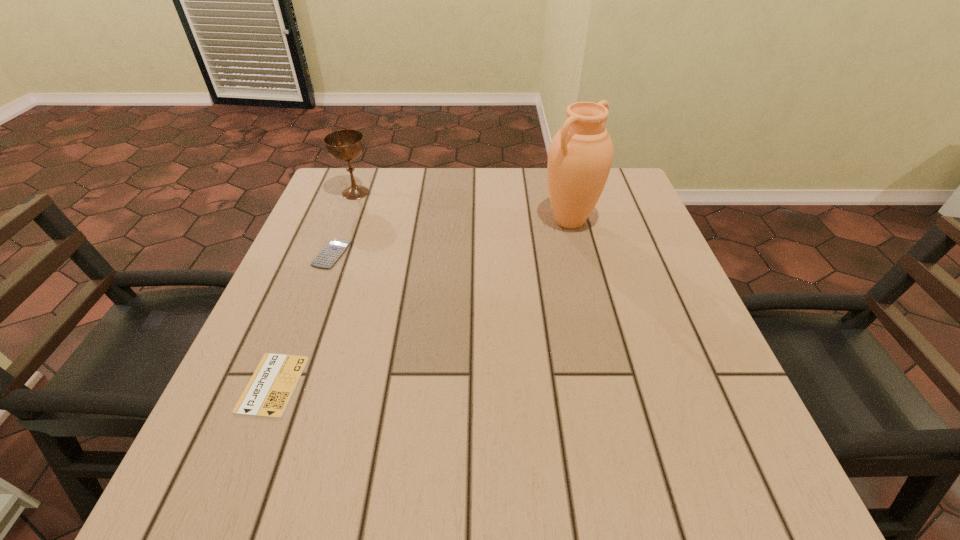
This screenshot has width=960, height=540. In order to click on free area in between the chalice and the rightmost object in this screenshot , I will do `click(463, 207)`.

At what (x,y) coordinates should I click in order to perform the action: click on free space between the tallest object and the identity card. Please return your answer as a coordinate pair (x, y). Looking at the image, I should click on (421, 303).

Where is `vacant region between the second farthest object and the shortest object`? The image size is (960, 540). vacant region between the second farthest object and the shortest object is located at coordinates (421, 303).

You are a GUI agent. You are given a task and a screenshot of the screen. Output one action in this format:
    pyautogui.click(x=<x>, y=<y>)
    Task: Click on the vacant area that lies between the third farthest object and the second tallest object
    This screenshot has height=540, width=960.
    Given the screenshot: What is the action you would take?
    pyautogui.click(x=344, y=223)

In order to click on unoccupied position between the second tallest object and the shortest object in this screenshot , I will do `click(314, 288)`.

Image resolution: width=960 pixels, height=540 pixels. Identify the location of the second closest object to the rightmost object. (332, 251).

Find the location of a particular element. object identified as the second closest to the urn is located at coordinates (332, 251).

The width and height of the screenshot is (960, 540). What are the coordinates of `free space in the image that satisfies the following two spatial constraints: 1. on the back side of the third nearest object; 2. on the left side of the identity card` in the screenshot? It's located at (338, 221).